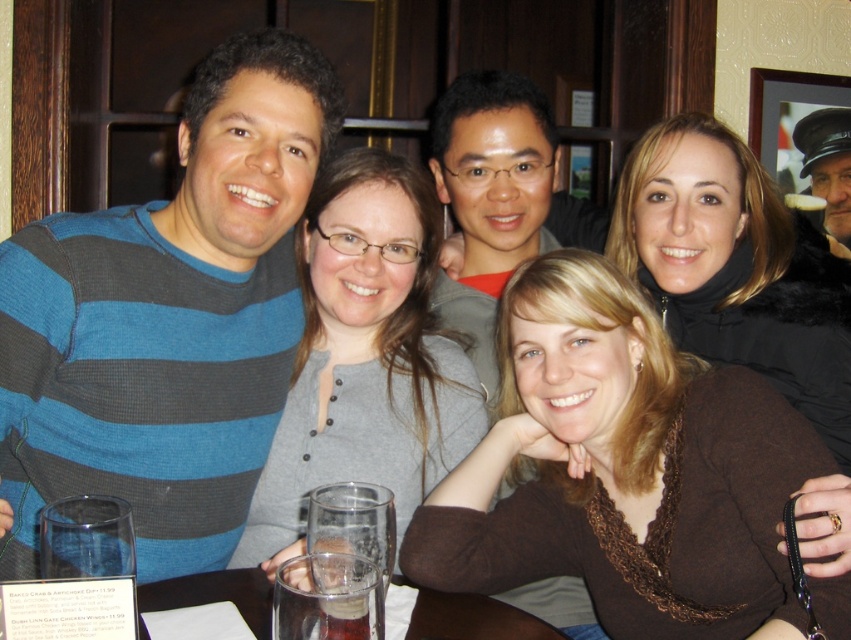
Can you confirm if gray button-up shirt at center is positioned above clear glass at table center?

Yes, gray button-up shirt at center is above clear glass at table center.

Who is more distant from viewer, (x=443, y=412) or (x=344, y=637)?

Positioned behind is point (x=443, y=412).

Where is `gray button-up shirt at center`? gray button-up shirt at center is located at coordinates (364, 355).

The image size is (851, 640). I want to click on gray button-up shirt at center, so click(x=364, y=355).

Is point (712, 417) positioned behind point (827, 284)?

That is False.

Can you confirm if brown textured sweater at center is positioned above brown fuzzy coat at upper right?

Incorrect, brown textured sweater at center is not positioned above brown fuzzy coat at upper right.

You are a GUI agent. You are given a task and a screenshot of the screen. Output one action in this format:
    pyautogui.click(x=<x>, y=<y>)
    Task: Click on the brown textured sweater at center
    This screenshot has height=640, width=851.
    Given the screenshot: What is the action you would take?
    pyautogui.click(x=621, y=468)

The image size is (851, 640). Find the location of `brown textured sweater at center`. brown textured sweater at center is located at coordinates (621, 468).

Is point (186, 582) positioned in front of point (335, 616)?

No, it is behind (335, 616).

Can you confirm if clear glass water at lower center is positioned below clear glass at table center?

Indeed, clear glass water at lower center is positioned under clear glass at table center.

The height and width of the screenshot is (640, 851). In order to click on clear glass water at lower center in this screenshot , I will do `click(472, 618)`.

Locate an element on the screen. The image size is (851, 640). clear glass water at lower center is located at coordinates (472, 618).